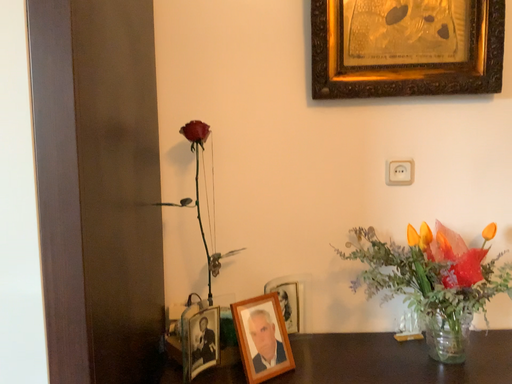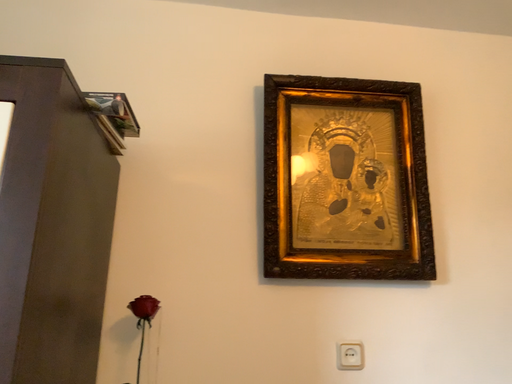
Question: How did the camera likely rotate when shooting the video?

Choices:
 (A) rotated right
 (B) rotated left

Answer: (A)